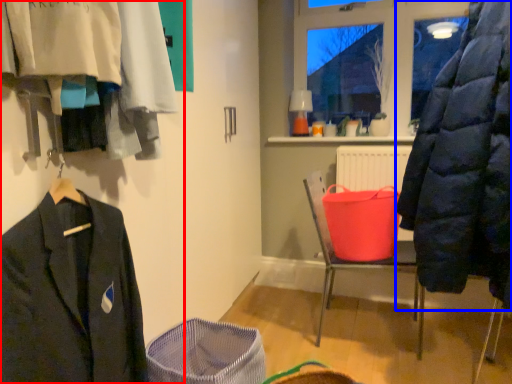
Question: Which of the following is the closest to the observer, closet (highlighted by a red box) or coat (highlighted by a blue box)?

Choices:
 (A) closet
 (B) coat

Answer: (A)